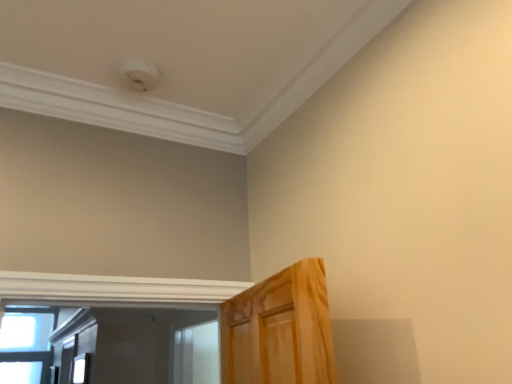
At what (x,y) coordinates should I click in order to perform the action: click on clear glass window at lower left. Please return your answer as a coordinate pair (x, y). Looking at the image, I should click on (80, 369).

What is the approximate width of clear glass window at lower left?

clear glass window at lower left is 2.57 centimeters wide.

What do you see at coordinates (80, 369) in the screenshot? I see `clear glass window at lower left` at bounding box center [80, 369].

The height and width of the screenshot is (384, 512). Find the location of `clear glass window at lower left`. clear glass window at lower left is located at coordinates (80, 369).